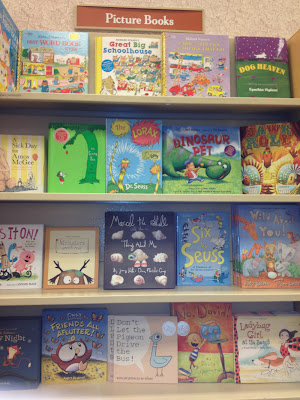
Locate an element on the screen. shelf side divider is located at coordinates (298, 67).